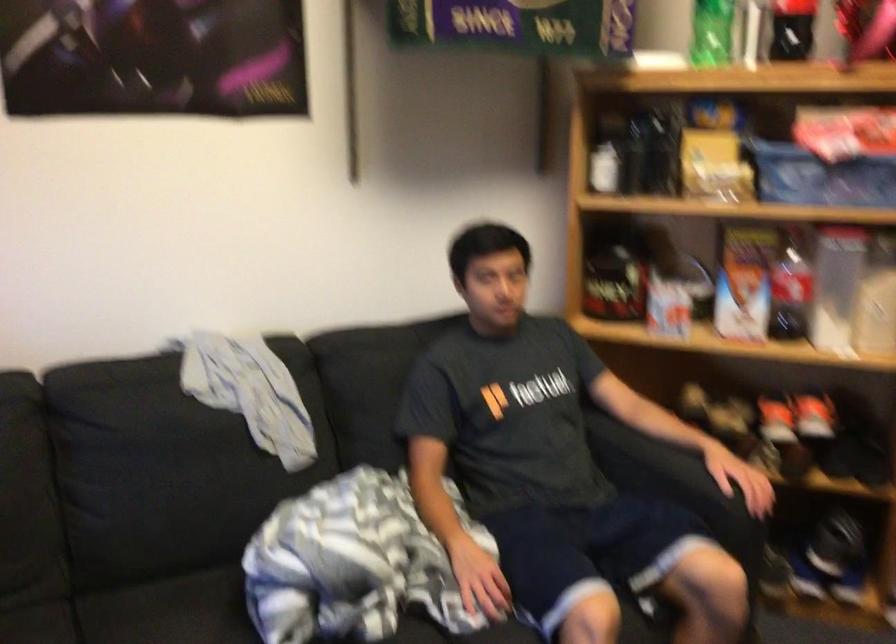
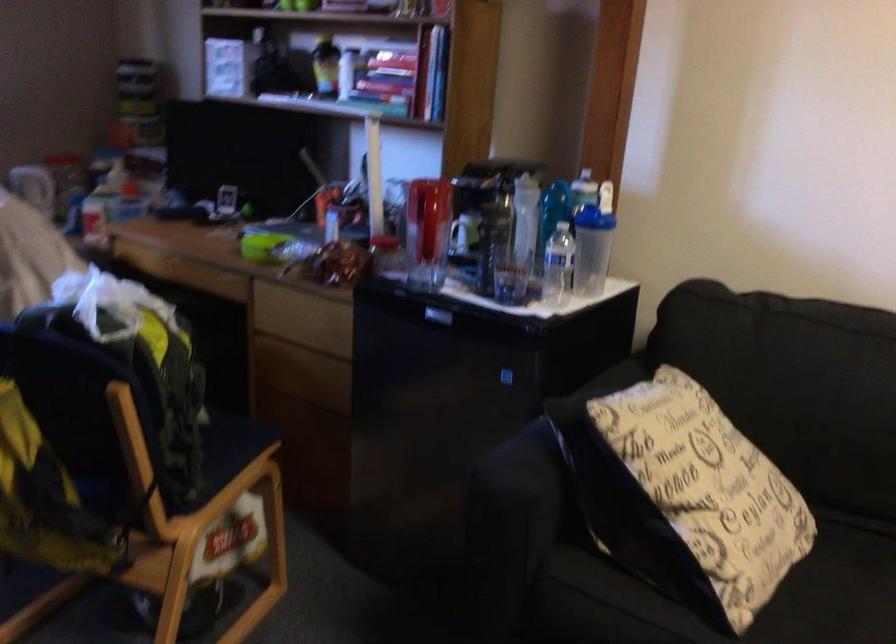
Question: How did the camera likely rotate?

Choices:
 (A) Left
 (B) Right
 (C) Up
 (D) Down

Answer: (A)